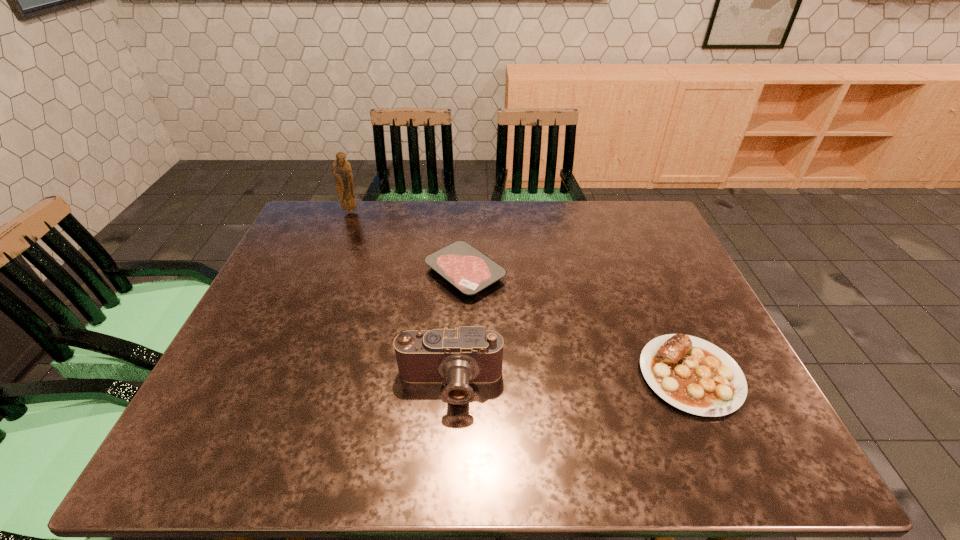
The width and height of the screenshot is (960, 540). Identify the location of object that is at the far edge. (341, 169).

The height and width of the screenshot is (540, 960). Identify the location of object at the left edge. (341, 169).

Image resolution: width=960 pixels, height=540 pixels. Find the location of `object at the right edge`. object at the right edge is located at coordinates (692, 374).

Where is `object that is at the far left corner`? object that is at the far left corner is located at coordinates (341, 169).

Identify the location of vacant space at the far edge of the desktop. (555, 202).

In the image, there is a desktop. Where is `vacant space at the near edge`? Image resolution: width=960 pixels, height=540 pixels. vacant space at the near edge is located at coordinates (458, 428).

At what (x,y) coordinates should I click in order to perform the action: click on vacant space at the left edge. Please return your answer as a coordinate pair (x, y). Image resolution: width=960 pixels, height=540 pixels. Looking at the image, I should click on (224, 395).

You are a GUI agent. You are given a task and a screenshot of the screen. Output one action in this format:
    pyautogui.click(x=<x>, y=<y>)
    Task: Click on the free space at the right edge
    
    Given the screenshot: What is the action you would take?
    pyautogui.click(x=710, y=321)

In the image, there is a desktop. Where is `vacant space at the far left corner`? vacant space at the far left corner is located at coordinates (343, 239).

Image resolution: width=960 pixels, height=540 pixels. What are the coordinates of `blank space at the near left corner of the desktop` in the screenshot? It's located at (243, 463).